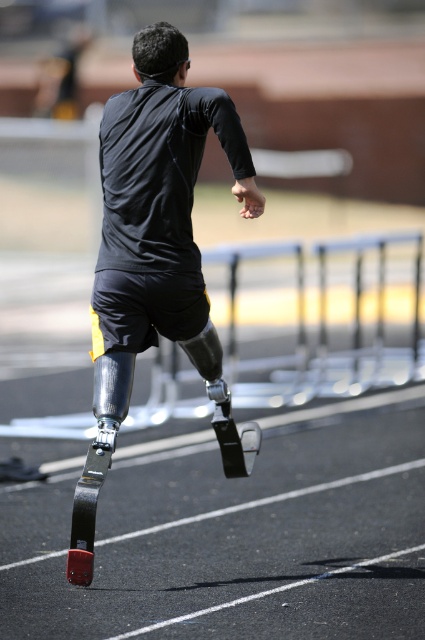
Is black rubber race track at lower left further to the viewer compared to matte black prosthetic leg at center?

No, black rubber race track at lower left is closer to the viewer.

Is black rubber race track at lower left below matte black prosthetic leg at center?

Correct, black rubber race track at lower left is located below matte black prosthetic leg at center.

Does point (16, 515) come behind point (150, 314)?

Yes.

You are a GUI agent. You are given a task and a screenshot of the screen. Output one action in this format:
    pyautogui.click(x=<x>, y=<y>)
    Task: Click on the black rubber race track at lower left
    This screenshot has height=640, width=425.
    Given the screenshot: What is the action you would take?
    pyautogui.click(x=237, y=538)